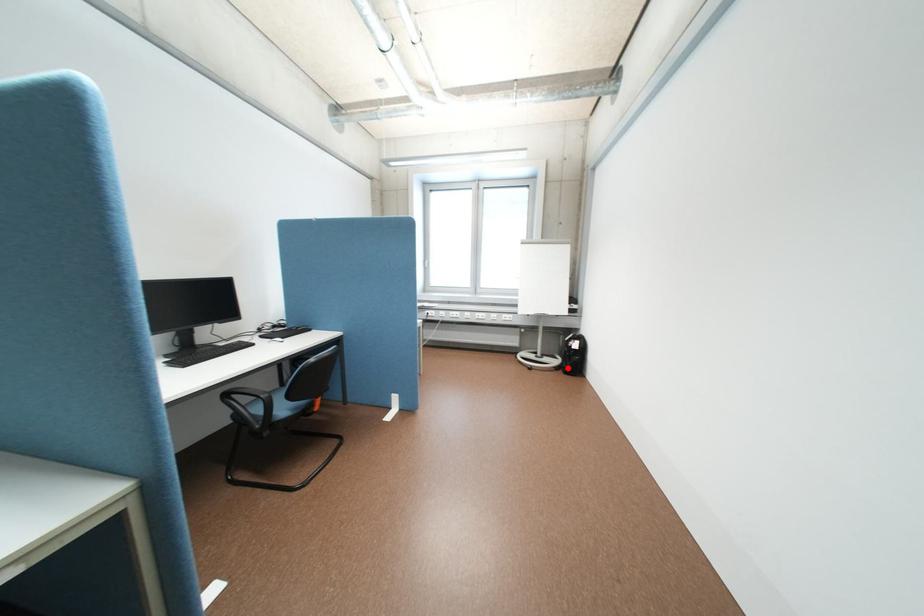
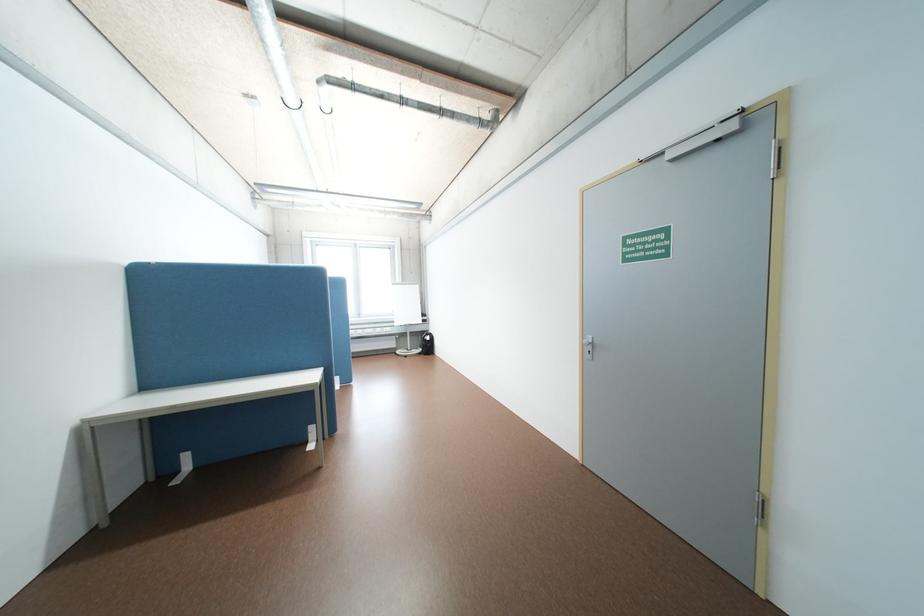
Where in the second image is the point corresponding to the highlighted location from the first image?

(431, 353)